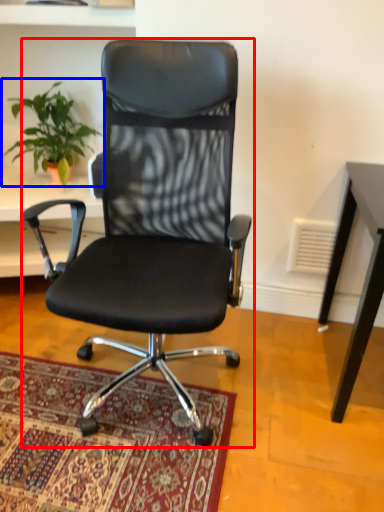
Question: Which object is closer to the camera taking this photo, chair (highlighted by a red box) or houseplant (highlighted by a blue box)?

Choices:
 (A) chair
 (B) houseplant

Answer: (A)